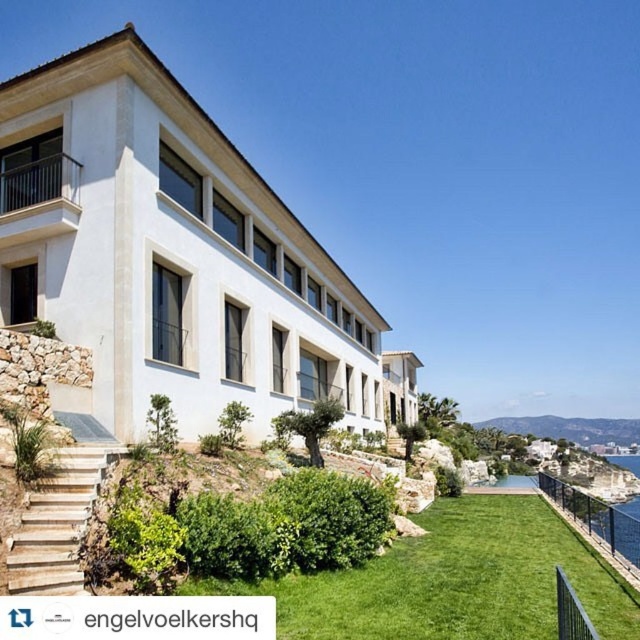
Who is positioned more to the right, white smooth villa at center or green grass at lower center?

green grass at lower center

Does white smooth villa at center lie in front of green grass at lower center?

That is False.

Between point (218, 225) and point (348, 632), which one is positioned in front?

Point (348, 632) is more forward.

You are a GUI agent. You are given a task and a screenshot of the screen. Output one action in this format:
    pyautogui.click(x=<x>, y=<y>)
    Task: Click on the white smooth villa at center
    Image resolution: width=640 pixels, height=640 pixels.
    Given the screenshot: What is the action you would take?
    pyautogui.click(x=173, y=257)

The height and width of the screenshot is (640, 640). What do you see at coordinates (452, 580) in the screenshot? I see `green grass at lower center` at bounding box center [452, 580].

Is green grass at lower center to the left of natural stone stairs at lower left from the viewer's perspective?

In fact, green grass at lower center is to the right of natural stone stairs at lower left.

This screenshot has height=640, width=640. What do you see at coordinates (452, 580) in the screenshot? I see `green grass at lower center` at bounding box center [452, 580].

You are a GUI agent. You are given a task and a screenshot of the screen. Output one action in this format:
    pyautogui.click(x=<x>, y=<y>)
    Task: Click on the green grass at lower center
    The image size is (640, 640).
    Given the screenshot: What is the action you would take?
    pyautogui.click(x=452, y=580)

Between point (250, 397) and point (58, 538), which one is positioned behind?

Positioned behind is point (250, 397).

Between point (81, 332) and point (48, 529), which one is positioned in front?

Positioned in front is point (48, 529).

Which is behind, point (260, 365) or point (92, 470)?

Point (260, 365)

This screenshot has height=640, width=640. I want to click on white smooth villa at center, so click(x=173, y=257).